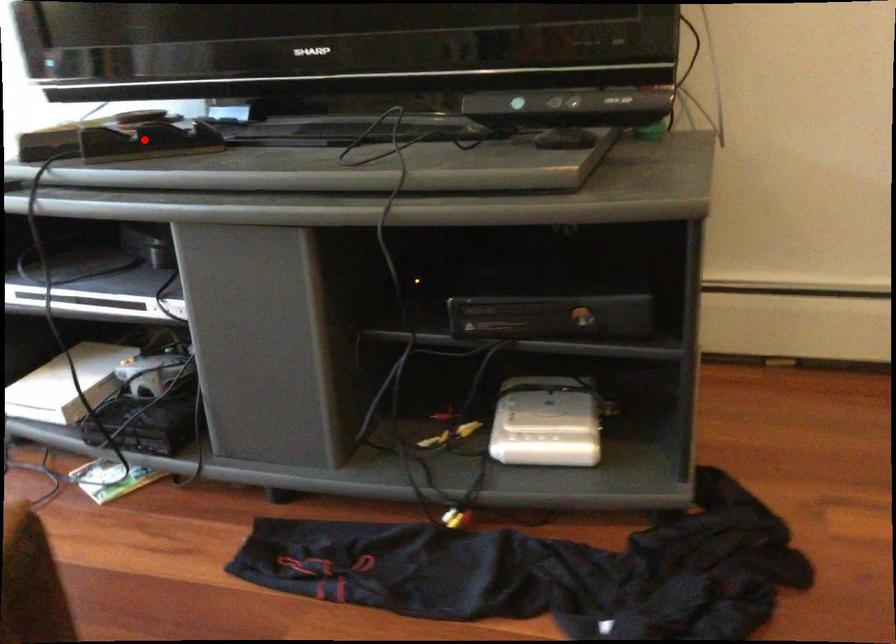
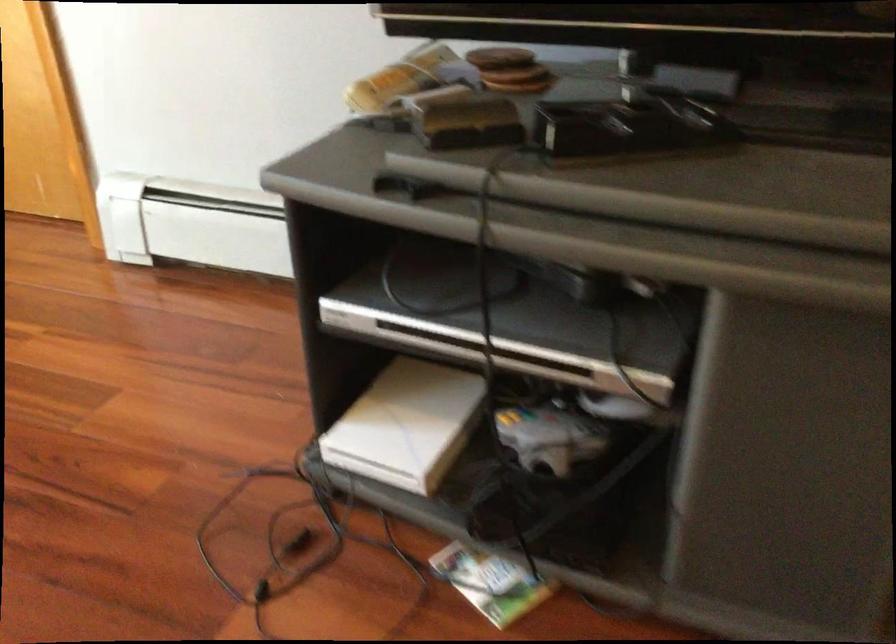
Question: I am providing you with two images of the same scene from different viewpoints. A red point is shown in image1. For the corresponding object point in image2, is it positioned nearer or farther from the camera?

Choices:
 (A) Nearer
 (B) Farther

Answer: (A)